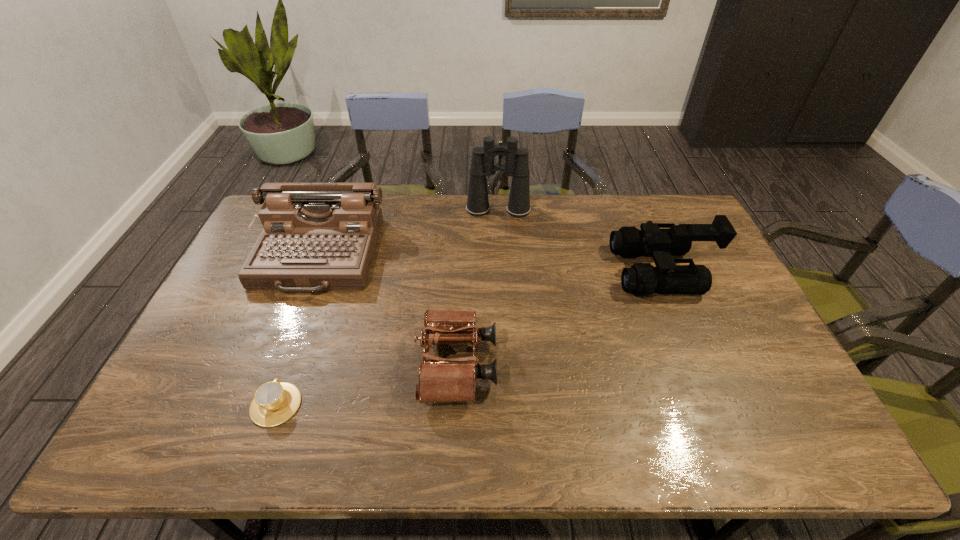
Locate an element on the screen. The height and width of the screenshot is (540, 960). vacant point located between the second tallest binoculars and the second shortest object is located at coordinates (560, 318).

Identify the location of unoccupied area between the shortest object and the tallest binoculars. (387, 307).

I want to click on free spot between the second shortest binoculars and the shortest binoculars, so coord(560,318).

Locate an element on the screen. The width and height of the screenshot is (960, 540). free space between the typewriter and the farthest binoculars is located at coordinates click(408, 233).

Locate an element on the screen. The width and height of the screenshot is (960, 540). empty location between the typewriter and the cup is located at coordinates coord(297,330).

In order to click on vacant space that is in between the shortest binoculars and the second nearest binoculars in this screenshot , I will do `click(560, 318)`.

Where is `vacant point located between the second tallest binoculars and the shortest binoculars`? The width and height of the screenshot is (960, 540). vacant point located between the second tallest binoculars and the shortest binoculars is located at coordinates pyautogui.click(x=560, y=318).

Identify the location of vacant space that is in between the tallest object and the typewriter. (408, 233).

Find the location of a particular element. The height and width of the screenshot is (540, 960). object that can be found as the closest to the second shortest object is located at coordinates (316, 236).

Locate an element on the screen. The image size is (960, 540). object that is the third closest to the fourth tallest object is located at coordinates (642, 279).